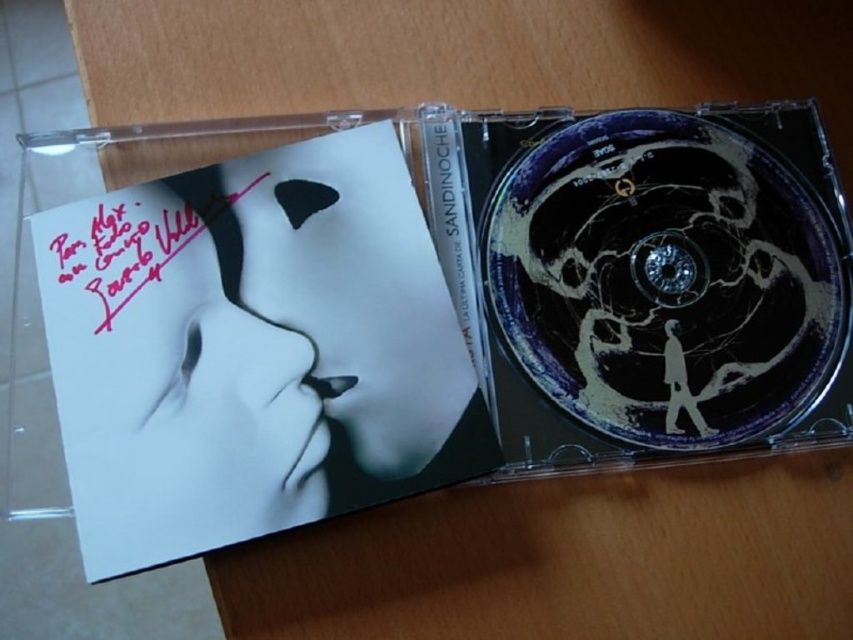
Question: Which object appears closest to the camera in this image?

Choices:
 (A) pink ink signature at upper left
 (B) white matte mask at upper left
 (C) satin black text at center

Answer: (B)

Question: Can you confirm if pink ink signature at upper left is positioned above satin black text at center?

Choices:
 (A) no
 (B) yes

Answer: (A)

Question: Is white matte mask at upper left further to camera compared to satin black text at center?

Choices:
 (A) no
 (B) yes

Answer: (A)

Question: Which of the following is the farthest from the observer?

Choices:
 (A) white matte mask at upper left
 (B) pink ink signature at upper left
 (C) satin black text at center

Answer: (C)

Question: From the image, what is the correct spatial relationship of pink ink signature at upper left in relation to satin black text at center?

Choices:
 (A) left
 (B) right

Answer: (A)

Question: Which point is closer to the camera?

Choices:
 (A) white matte mask at upper left
 (B) pink ink signature at upper left
 (C) satin black text at center

Answer: (A)